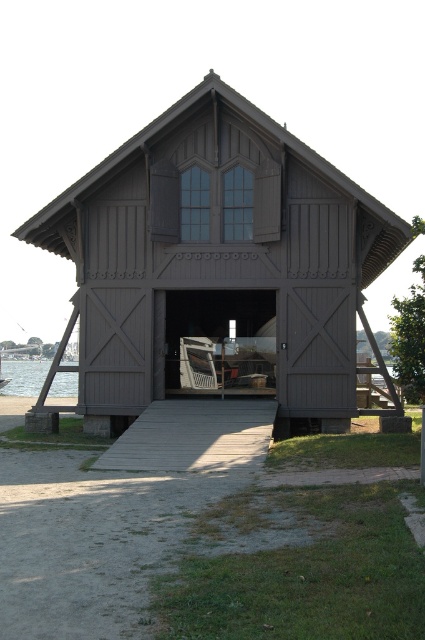
Question: Which point is farther to the camera?

Choices:
 (A) matte brown wooden barn at center
 (B) clear water at lower left

Answer: (B)

Question: Considering the relative positions of matte brown wooden barn at center and wooden ramp at center in the image provided, where is matte brown wooden barn at center located with respect to wooden ramp at center?

Choices:
 (A) left
 (B) right

Answer: (B)

Question: Is matte brown wooden barn at center to the right of matte wood chair at center from the viewer's perspective?

Choices:
 (A) no
 (B) yes

Answer: (B)

Question: Which object is farther from the camera taking this photo?

Choices:
 (A) matte brown wooden barn at center
 (B) clear water at entrance center

Answer: (B)

Question: Based on their relative distances, which object is farther from the wooden ramp at center?

Choices:
 (A) matte wood chair at center
 (B) matte brown wooden barn at center

Answer: (B)

Question: Is clear water at entrance center closer to camera compared to clear water at lower left?

Choices:
 (A) no
 (B) yes

Answer: (B)